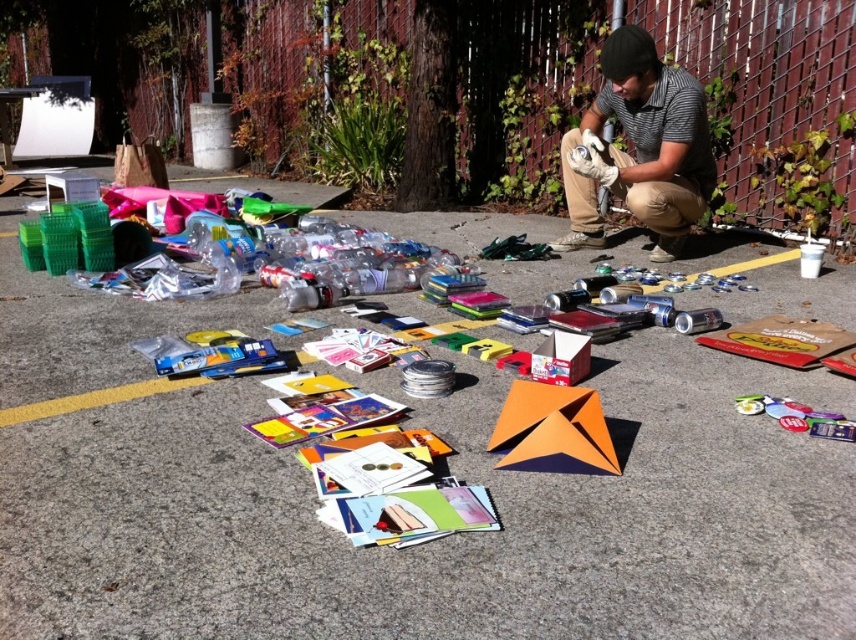
Between point (171, 534) and point (603, 164), which one is positioned in front?

Point (171, 534) is in front.

Does point (105, 600) come farther from viewer compared to point (652, 134)?

That is False.

Between point (681, 602) and point (681, 177), which one is positioned behind?

Positioned behind is point (681, 177).

Locate an element on the screen. orange paper airplane at center is located at coordinates (385, 548).